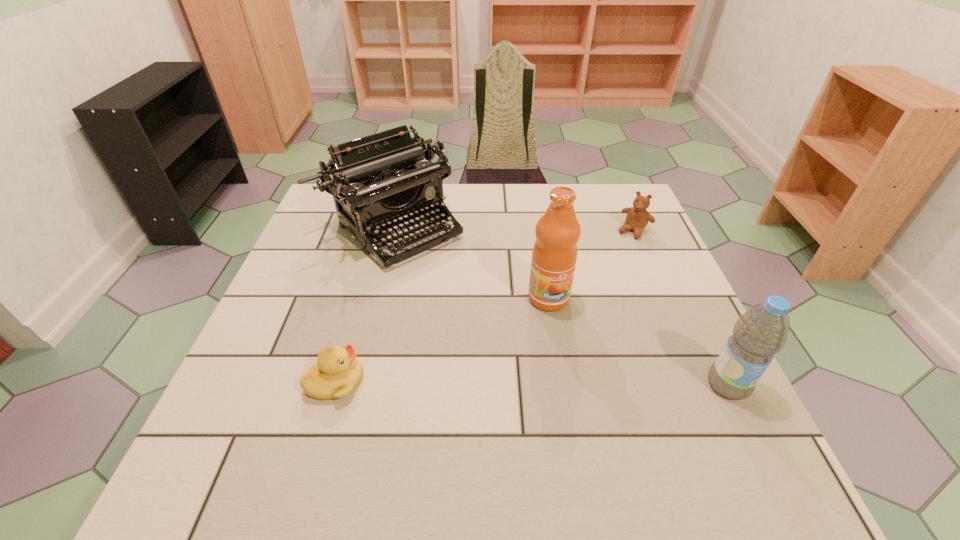
Where is `vacant space at the near edge`? vacant space at the near edge is located at coordinates (361, 397).

Locate an element on the screen. free space at the left edge of the desktop is located at coordinates (354, 264).

In the image, there is a desktop. Find the location of `free region at the right edge`. free region at the right edge is located at coordinates (700, 380).

The width and height of the screenshot is (960, 540). Find the location of `blank space at the far right corner of the desktop`. blank space at the far right corner of the desktop is located at coordinates (620, 187).

I want to click on empty space between the third object from right to left and the water bottle, so click(638, 341).

Find the location of a particular element. empty space between the duckling and the typewriter is located at coordinates (363, 303).

Locate an element on the screen. Image resolution: width=960 pixels, height=540 pixels. free space between the water bottle and the tallest object is located at coordinates (638, 341).

Where is `free space between the typewriter and the fruit juice`? This screenshot has width=960, height=540. free space between the typewriter and the fruit juice is located at coordinates (469, 262).

What are the coordinates of `unoccupied area between the fourth tallest object and the typewriter` in the screenshot? It's located at (513, 228).

Where is `empty location between the water bottle and the second shortest object`? The image size is (960, 540). empty location between the water bottle and the second shortest object is located at coordinates (681, 308).